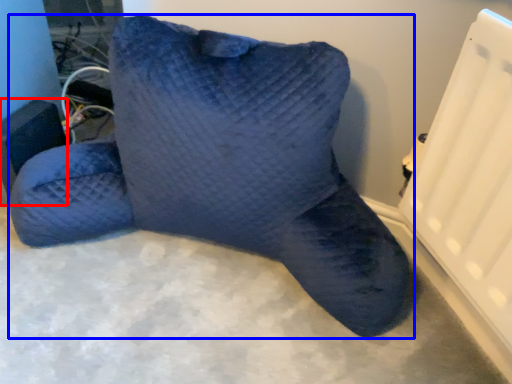
Question: Which object is closer to the camera taking this photo, speaker (highlighted by a red box) or furniture (highlighted by a blue box)?

Choices:
 (A) speaker
 (B) furniture

Answer: (B)